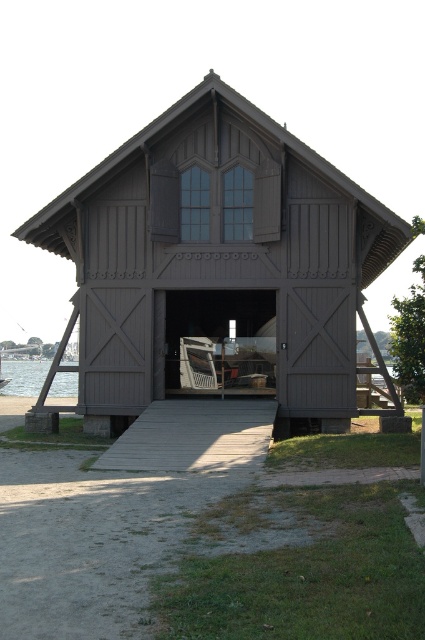
You are standing outside the boathouse and want to place a small wooden crate between the clear water at entrance center and the matte wood chair at center. Can the crate fit between them if the crate requires 1 meter of space?

The clear water at entrance center is wider than the matte wood chair at center, but the exact width isn

You are standing in front of the rustic wooden boathouse and want to determine the relative positions of two points marked on the boathouse structure. The first point is at coordinate point (119, 442) and the second is at coordinate point (23, 365). Which point is closer to you?

Point (119, 442) is closer to the camera than point (23, 365).

You are standing at the entrance of the rustic wooden boathouse and want to sit down. You see a wooden ramp at center and a matte wood chair at center. Which object is closer to the floor?

The wooden ramp at center is located below the matte wood chair at center, so the wooden ramp at center is closer to the floor.